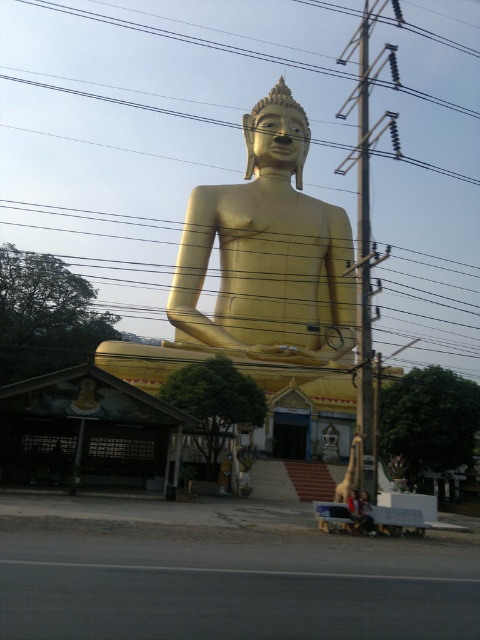
In the scene shown: Does metallic pole at right appear under matte gold statue at center?

Actually, metallic pole at right is above matte gold statue at center.

Is point (365, 296) positioned before point (369, 518)?

No, (365, 296) is behind (369, 518).

Locate an element on the screen. This screenshot has width=480, height=640. metallic pole at right is located at coordinates (363, 268).

This screenshot has height=640, width=480. What are the coordinates of `black wire at upper center` in the screenshot? It's located at (151, 125).

Is point (423, 108) in front of point (286, 92)?

That is False.

What do you see at coordinates (151, 125) in the screenshot? This screenshot has width=480, height=640. I see `black wire at upper center` at bounding box center [151, 125].

Locate an element on the screen. Image resolution: width=480 pixels, height=640 pixels. black wire at upper center is located at coordinates (151, 125).

Is black wire at upper center positioned at the back of matte gold statue at center?

That is True.

Is black wire at upper center to the right of matte gold statue at center from the viewer's perspective?

No, black wire at upper center is not to the right of matte gold statue at center.

Who is more forward, (91,106) or (373,529)?

Point (373,529) is in front.

You are a GUI agent. You are given a task and a screenshot of the screen. Output one action in this format:
    pyautogui.click(x=<x>, y=<y>)
    Task: Click on the black wire at upper center
    
    Given the screenshot: What is the action you would take?
    pyautogui.click(x=151, y=125)